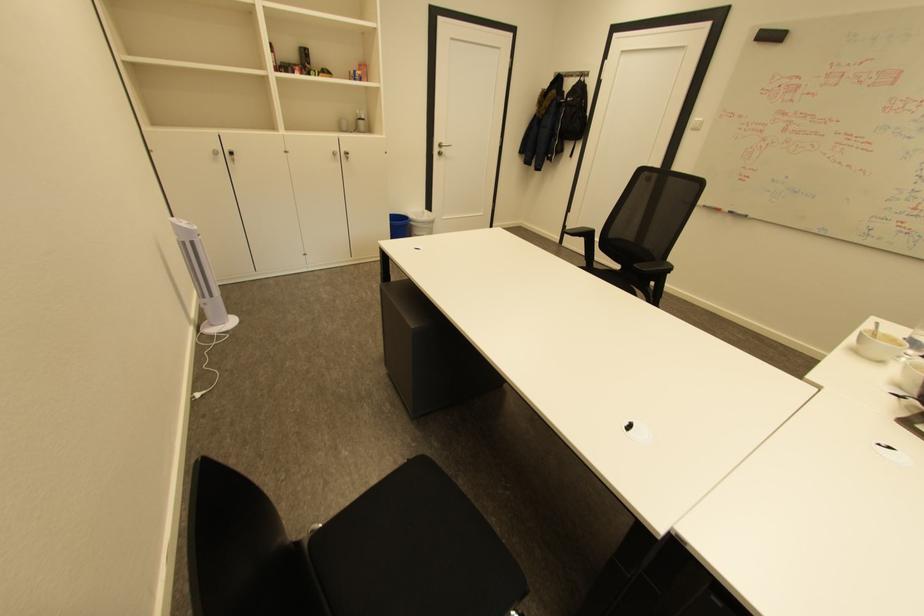
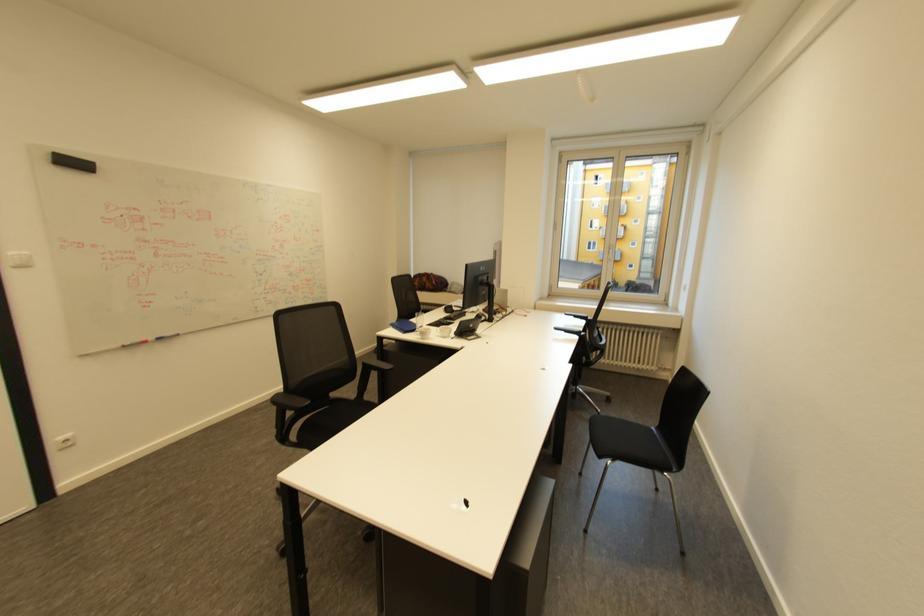
The point at (737,212) is marked in the first image. Where is the corresponding point in the second image?

(164, 339)